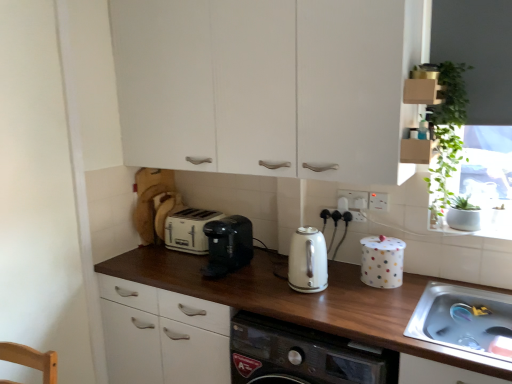
The width and height of the screenshot is (512, 384). Identify the location of free space above brown wood countertop at center (from a real-world perspective). (285, 284).